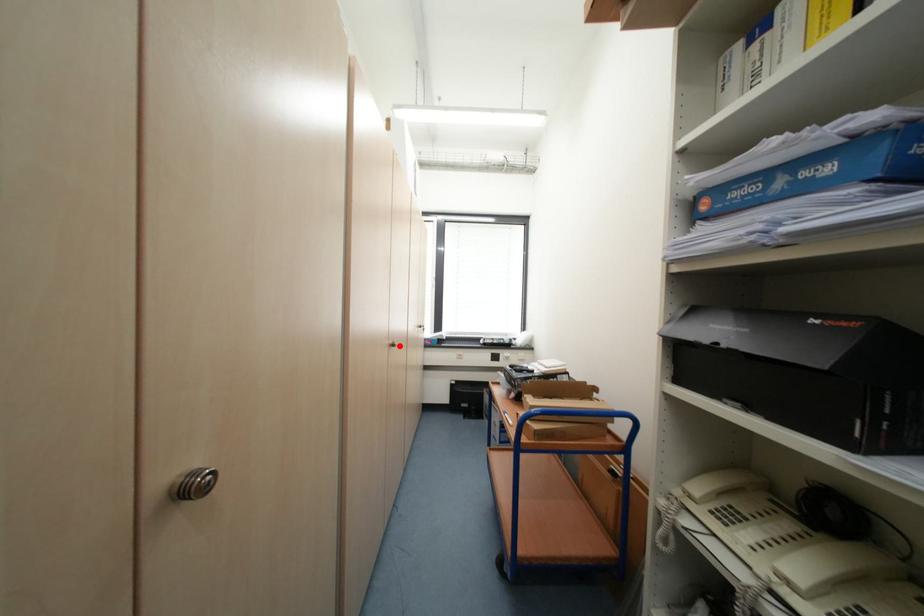
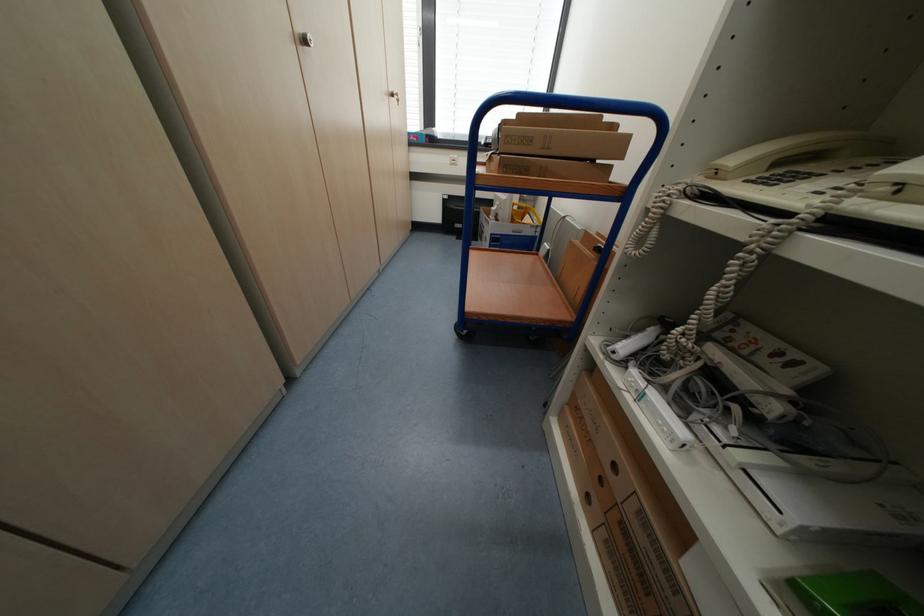
Where in the second image is the point corresponding to the highlighted location from the first image?

(311, 42)